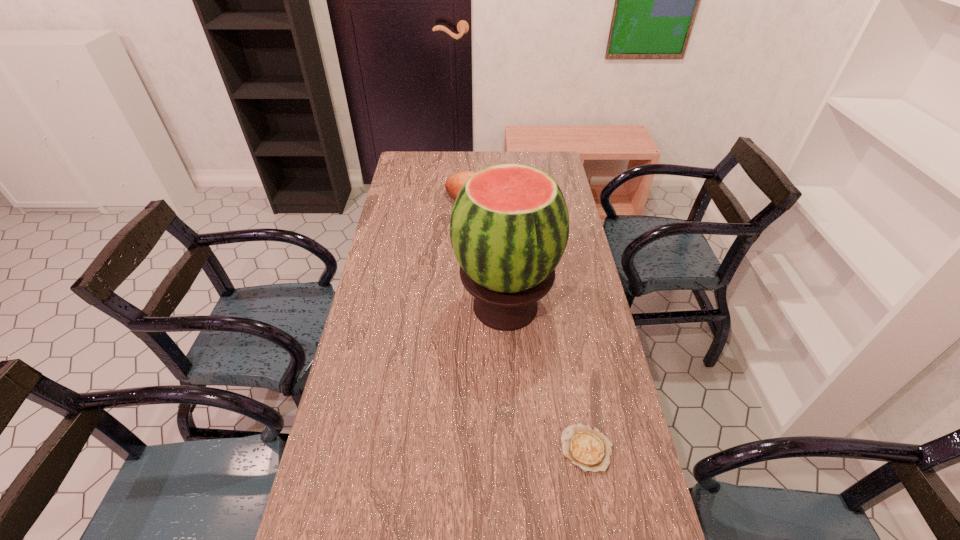
Where is `quiche that is at the right edge`? Image resolution: width=960 pixels, height=540 pixels. quiche that is at the right edge is located at coordinates (587, 447).

Locate an element on the screen. The image size is (960, 540). vacant position at the left edge of the desktop is located at coordinates (412, 253).

Identify the location of vacant space at the right edge of the desktop. (557, 348).

Where is `blank area at the far left corner`? This screenshot has width=960, height=540. blank area at the far left corner is located at coordinates (x=431, y=160).

Locate an element on the screen. The image size is (960, 540). free point between the farthest object and the quiche is located at coordinates point(534,327).

Where is `free area in between the watermelon and the nearest object`? This screenshot has height=540, width=960. free area in between the watermelon and the nearest object is located at coordinates (546, 377).

Where is `vacant region between the shortest object and the watermelon`? This screenshot has width=960, height=540. vacant region between the shortest object and the watermelon is located at coordinates (546, 377).

Find the location of a particular element. The image size is (960, 540). empty location between the second nearest object and the nearest object is located at coordinates (546, 377).

I want to click on free spot between the quiche and the watermelon, so pyautogui.click(x=546, y=377).

This screenshot has height=540, width=960. In order to click on free space that is in between the tallest object and the shortest object in this screenshot , I will do `click(546, 377)`.